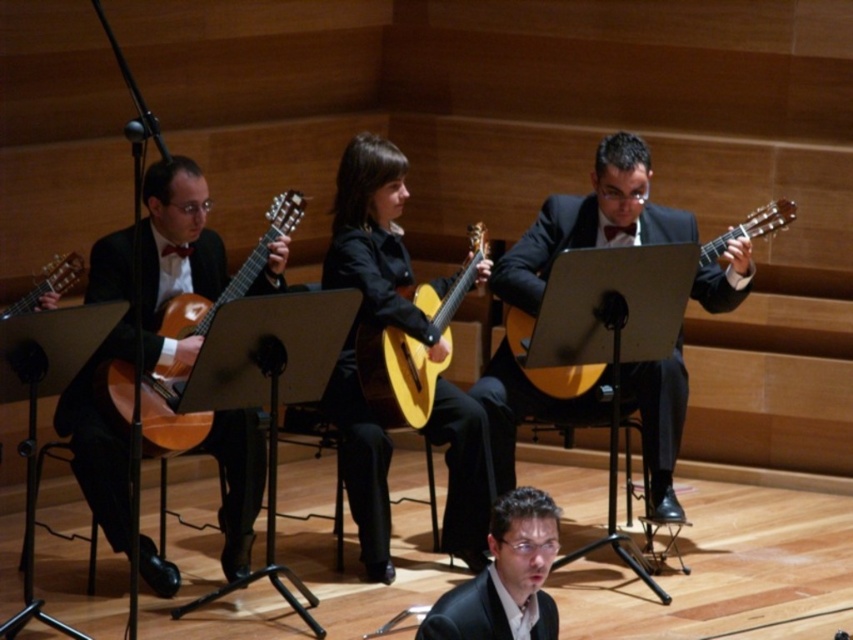
Question: Which point is farther to the camera?

Choices:
 (A) (723, 240)
 (B) (209, 260)
 (C) (183, 337)

Answer: (A)

Question: In this image, where is matte black suit at lower center located relative to matte wood guitar at center?

Choices:
 (A) left
 (B) right

Answer: (A)

Question: Is shiny black suit at center to the right of matte wood guitar at center from the viewer's perspective?

Choices:
 (A) yes
 (B) no

Answer: (A)

Question: Which object is farther from the camera taking this photo?

Choices:
 (A) matte black suit at lower center
 (B) shiny black guitar at left

Answer: (B)

Question: Does shiny black suit at center have a lesser width compared to matte wood guitar at center?

Choices:
 (A) yes
 (B) no

Answer: (B)

Question: Among these points, which one is farthest from the camera?

Choices:
 (A) [372, 410]
 (B) [578, 413]

Answer: (B)